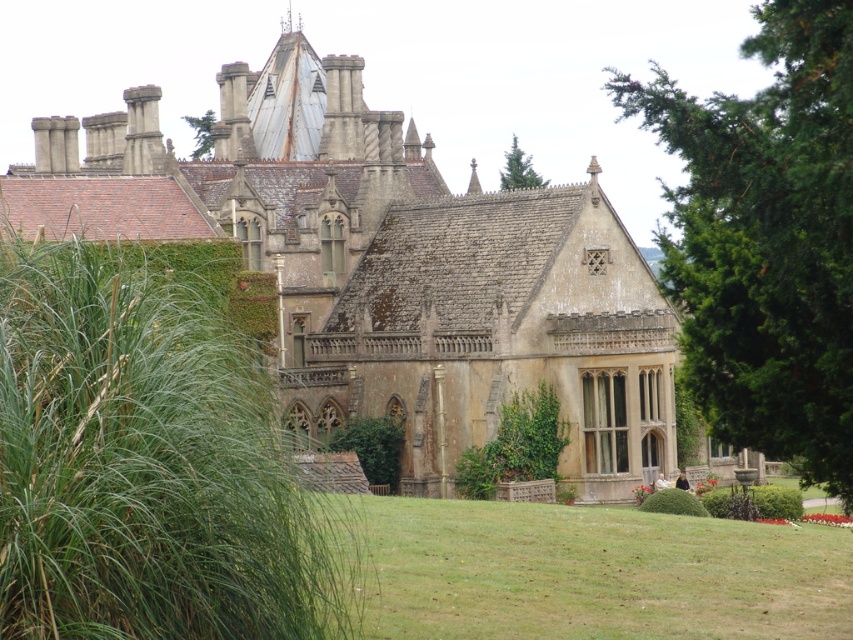
Which is in front, point (585, 465) or point (204, 154)?

Point (585, 465) is in front.

Is stone mansion at center thinner than green leafy tree at upper center?

In fact, stone mansion at center might be wider than green leafy tree at upper center.

Who is more forward, (508, 323) or (202, 113)?

Point (508, 323)

This screenshot has width=853, height=640. In order to click on stone mansion at center in this screenshot , I will do `click(402, 269)`.

Locate an element on the screen. Image resolution: width=853 pixels, height=640 pixels. stone mansion at center is located at coordinates (402, 269).

Who is more distant from viewer, (61, 150) or (395, 557)?

The point (61, 150) is behind.

The width and height of the screenshot is (853, 640). Identify the location of stone mansion at center. (402, 269).

Who is positioned more to the left, green coniferous tree at upper center or green leafy tree at upper center?

Positioned to the left is green leafy tree at upper center.

Can you confirm if green coniferous tree at upper center is shorter than green leafy tree at upper center?

Incorrect, green coniferous tree at upper center's height does not fall short of green leafy tree at upper center's.

Who is more distant from viewer, (520, 184) or (212, 122)?

Positioned behind is point (212, 122).

Locate an element on the screen. green coniferous tree at upper center is located at coordinates (518, 170).